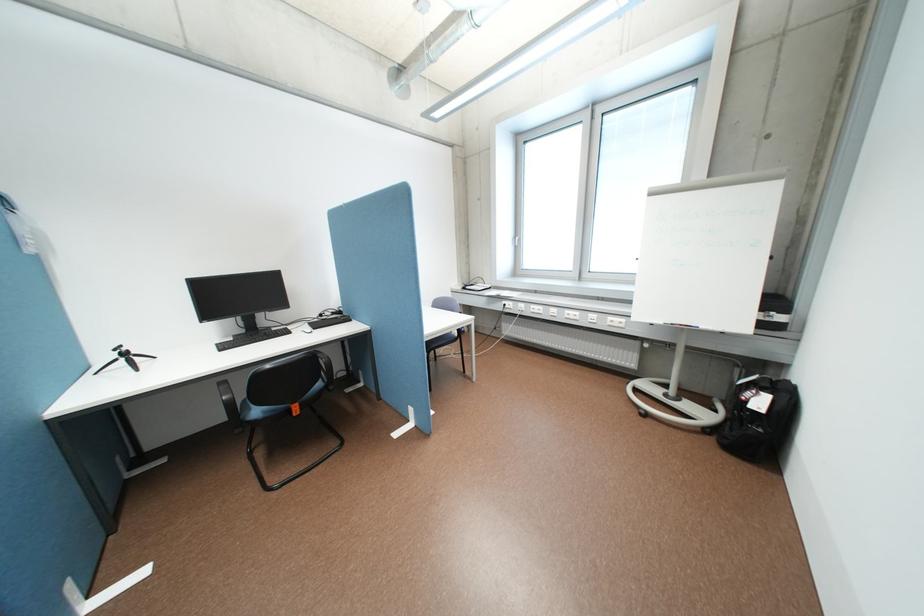
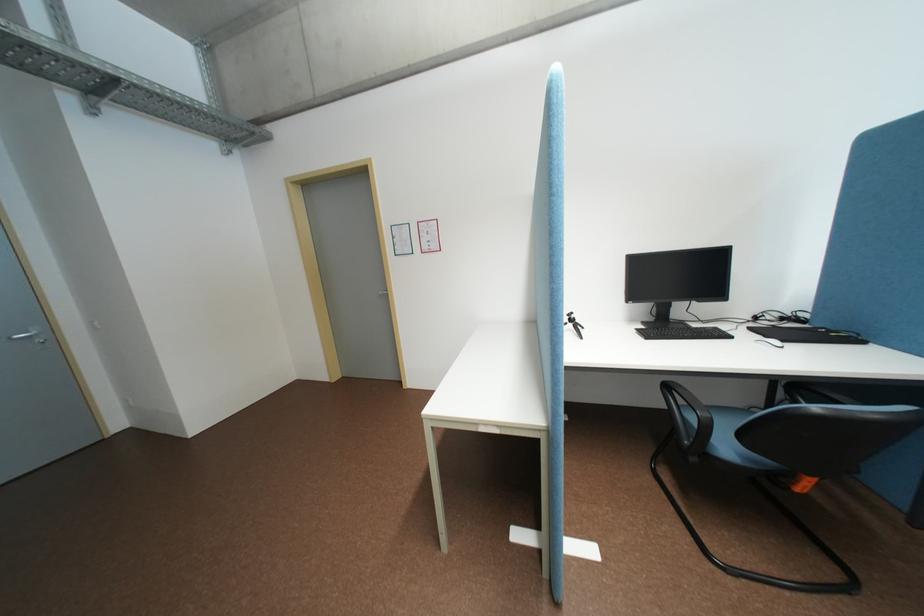
Where in the second image is the point corresponding to [132,360] from the first image?

(581, 325)